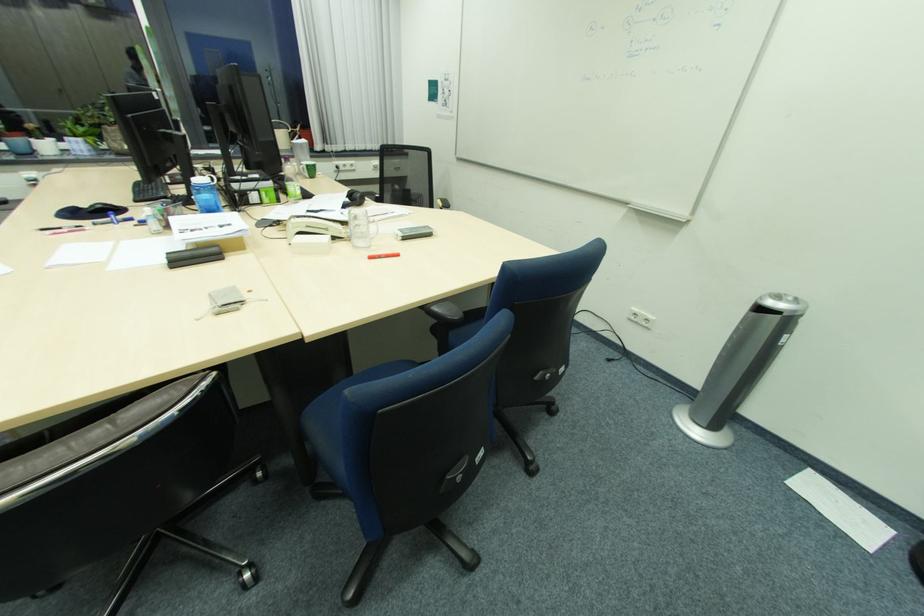
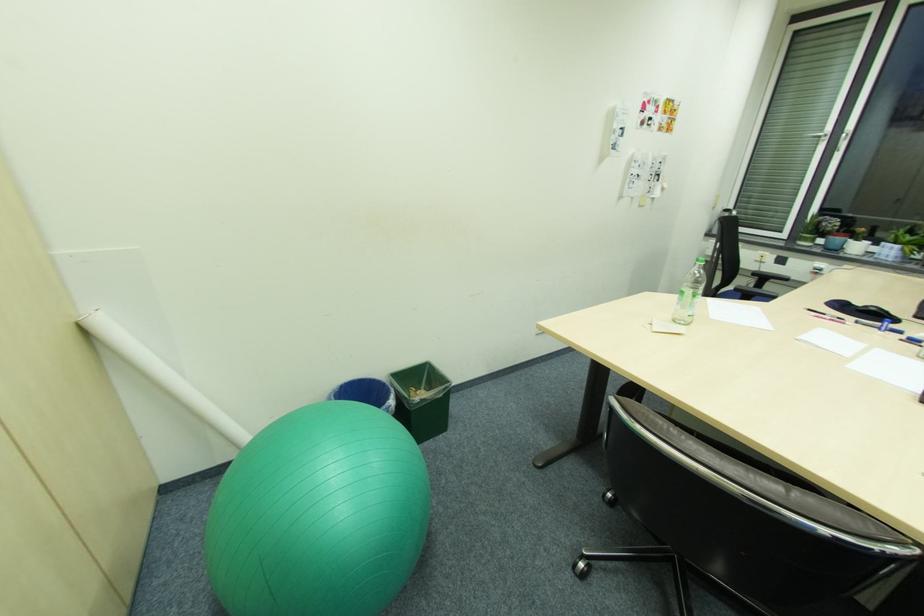
In the second image, find the point that corresponds to point 88,140 in the first image.

(903, 246)